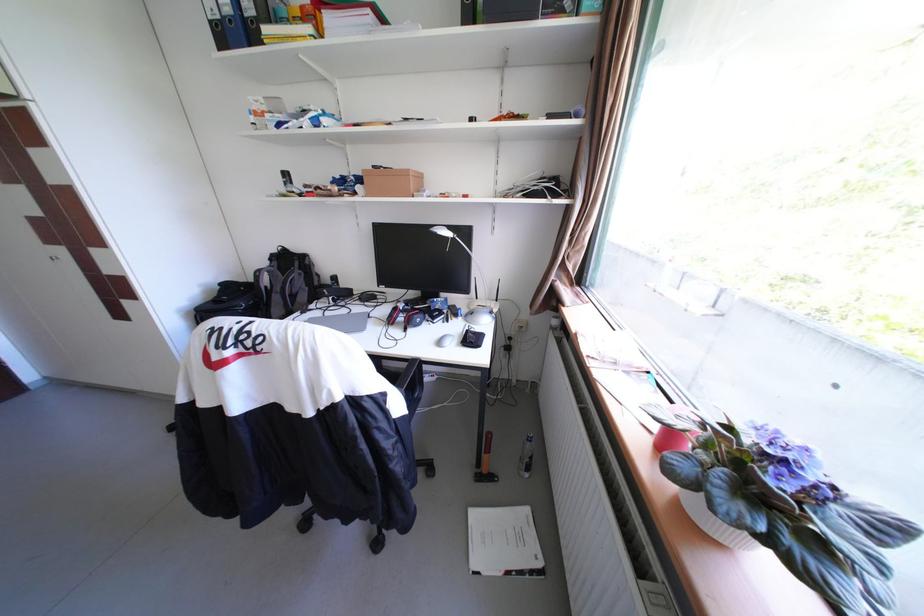
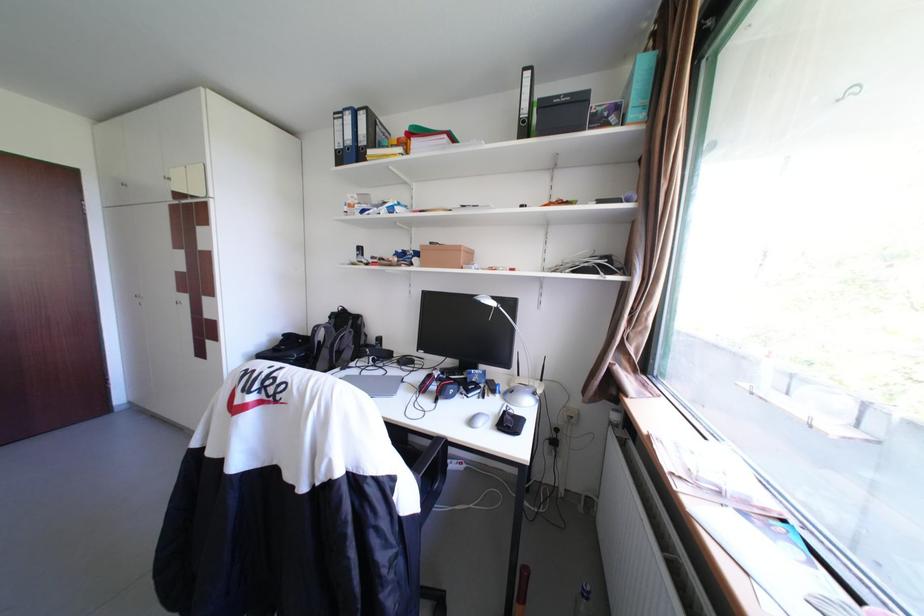
Question: I am providing you with two images of the same scene from different viewpoints. Please identify which objects are invisible in image2.

Choices:
 (A) binder finger hole
 (B) blue ring binder
 (C) cardboard box
 (D) none of these

Answer: (D)